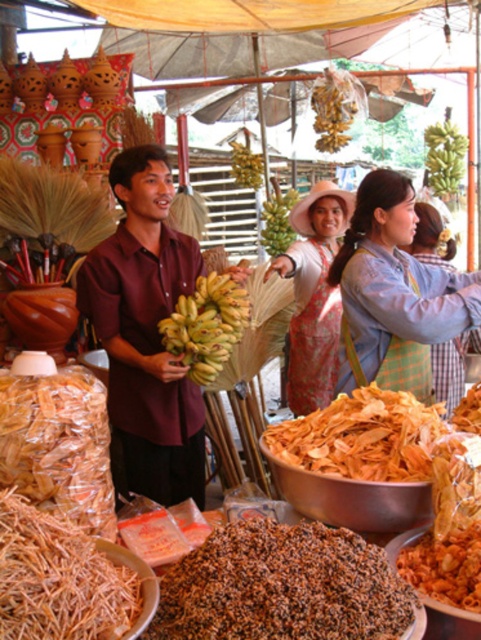
Does white woven hat at center appear on the left side of green matte bananas at center?

In fact, white woven hat at center is to the right of green matte bananas at center.

Is point (307, 360) positioned before point (268, 202)?

Yes, it is.

Where is `white woven hat at center`? white woven hat at center is located at coordinates (314, 296).

Who is more forward, (153, 456) or (437, 163)?

Point (153, 456)

Consider the image. Who is shorter, maroon shirt at center or green matte bananas at upper right?

green matte bananas at upper right is shorter.

Between point (200, 428) and point (451, 150), which one is positioned in front?

Point (200, 428) is in front.

The width and height of the screenshot is (481, 640). In order to click on maroon shirt at center in this screenshot , I will do `click(146, 333)`.

Which is more to the right, yellow-green bananas at center or green matte bananas at center?

From the viewer's perspective, green matte bananas at center appears more on the right side.

Is yellow-green bananas at center shorter than green matte bananas at center?

Indeed, yellow-green bananas at center has a lesser height compared to green matte bananas at center.

Does point (189, 358) come closer to viewer compared to point (262, 230)?

Yes, it is in front of point (262, 230).

At what (x,y) coordinates should I click in order to perform the action: click on yellow-green bananas at center. Please return your answer as a coordinate pair (x, y). Looking at the image, I should click on (205, 324).